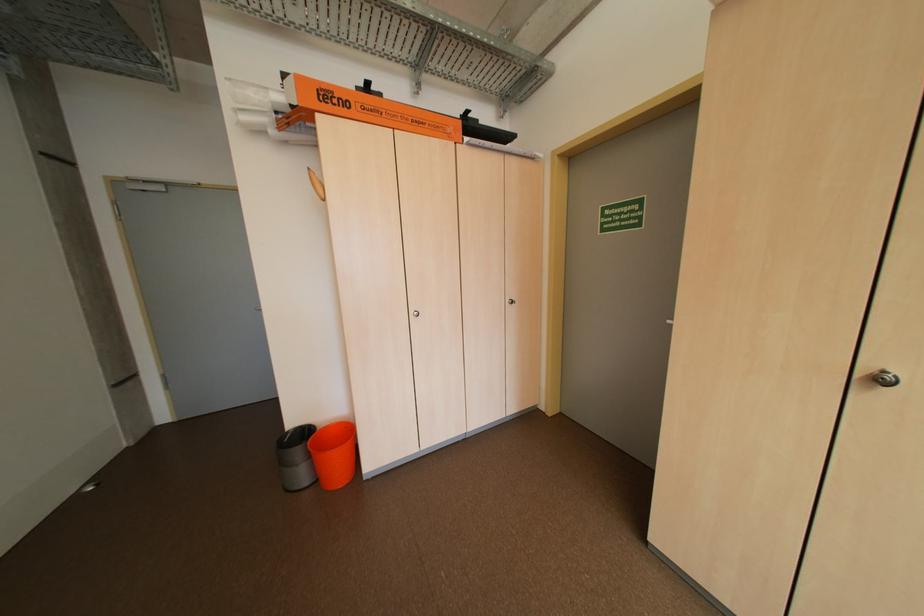
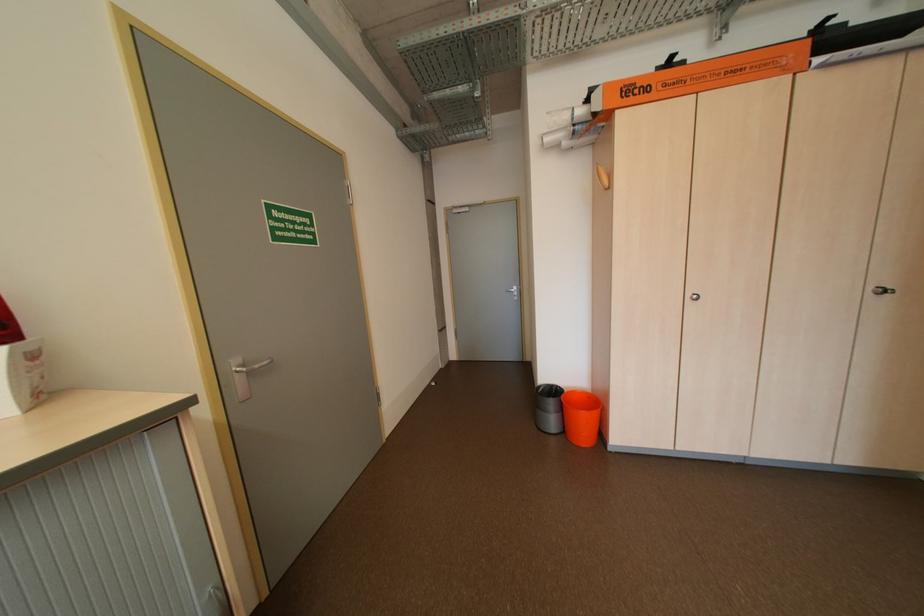
In the second image, find the point that corresponds to (517,301) in the first image.

(880, 290)